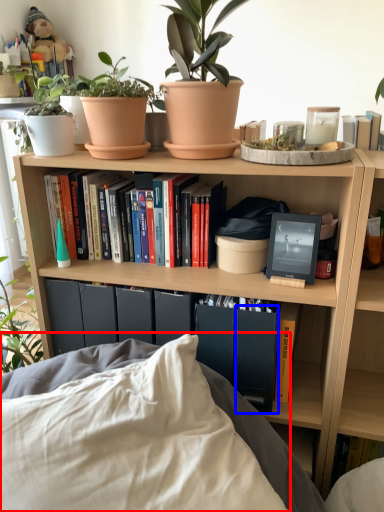
Question: Which object appears farthest to the camera in this image, pillow (highlighted by a red box) or paperback book (highlighted by a blue box)?

Choices:
 (A) pillow
 (B) paperback book

Answer: (B)